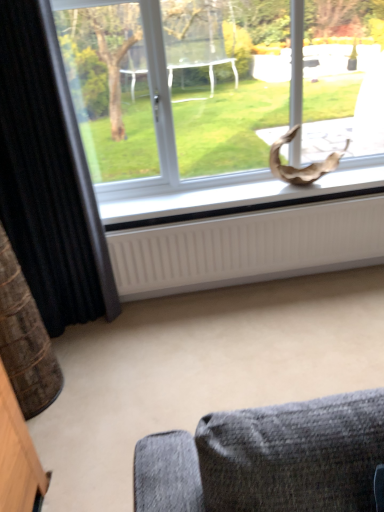
Question: Should I look upward or downward to see white matte window sill at center?

Choices:
 (A) up
 (B) down

Answer: (A)

Question: Are white ribbed radiator at lower center and transparent glass window at upper center located far from each other?

Choices:
 (A) no
 (B) yes

Answer: (A)

Question: Does white ribbed radiator at lower center lie in front of transparent glass window at upper center?

Choices:
 (A) yes
 (B) no

Answer: (B)

Question: Can you confirm if white ribbed radiator at lower center is shorter than transparent glass window at upper center?

Choices:
 (A) yes
 (B) no

Answer: (A)

Question: Does white ribbed radiator at lower center turn towards transparent glass window at upper center?

Choices:
 (A) yes
 (B) no

Answer: (B)

Question: From the image's perspective, would you say white ribbed radiator at lower center is positioned over transparent glass window at upper center?

Choices:
 (A) no
 (B) yes

Answer: (A)

Question: Is white ribbed radiator at lower center beside transparent glass window at upper center?

Choices:
 (A) yes
 (B) no

Answer: (B)

Question: Does white matte window sill at center appear on the right side of white ribbed radiator at lower center?

Choices:
 (A) no
 (B) yes

Answer: (B)

Question: Is white matte window sill at center closer to camera compared to white ribbed radiator at lower center?

Choices:
 (A) no
 (B) yes

Answer: (A)

Question: From a real-world perspective, is white matte window sill at center positioned over white ribbed radiator at lower center based on gravity?

Choices:
 (A) yes
 (B) no

Answer: (A)

Question: Can you see white matte window sill at center touching white ribbed radiator at lower center?

Choices:
 (A) yes
 (B) no

Answer: (B)

Question: From the image's perspective, is white matte window sill at center above white ribbed radiator at lower center?

Choices:
 (A) no
 (B) yes

Answer: (B)

Question: Would you say white matte window sill at center is a long distance from white ribbed radiator at lower center?

Choices:
 (A) no
 (B) yes

Answer: (A)

Question: Is the position of white matte window sill at center less distant than that of transparent glass window at upper center?

Choices:
 (A) no
 (B) yes

Answer: (A)